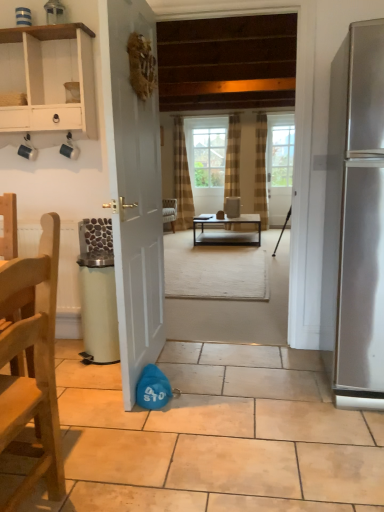
Question: In terms of width, does brown textured curtain at center look wider or thinner when compared to wooden chair at left?

Choices:
 (A) wide
 (B) thin

Answer: (B)

Question: From a real-world perspective, relative to wooden chair at left, is brown textured curtain at center vertically above or below?

Choices:
 (A) above
 (B) below

Answer: (A)

Question: Considering the real-world distances, which object is closest to the satin silver refrigerator at right?

Choices:
 (A) green matte trash can at lower left
 (B) metallic silver desk at center
 (C) brown textured curtain at center
 (D) white matte door at center, which ranks as the second door in back-to-front order
 (E) white wood cabinet at upper left

Answer: (D)

Question: Considering the real-world distances, which object is farthest from the matte black coffee cup at upper left?

Choices:
 (A) white wood cabinet at upper left
 (B) wooden floor at center
 (C) wooden chair at left
 (D) brown textured curtain at center
 (E) white matte door at center, the second door positioned from the right

Answer: (D)